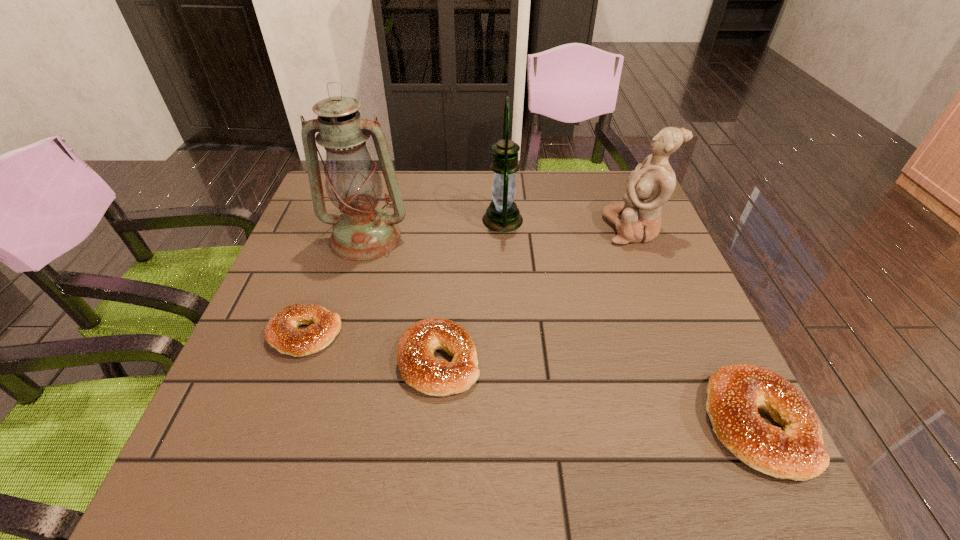
Where is `free space in the image that satisfies the following two spatial constraints: 1. on the front-facing side of the figurine; 2. on the front side of the second shortest bagel`? This screenshot has width=960, height=540. free space in the image that satisfies the following two spatial constraints: 1. on the front-facing side of the figurine; 2. on the front side of the second shortest bagel is located at coordinates (686, 361).

Where is `blank area in the image that satisfies the following two spatial constraints: 1. on the side where the fifth shortest object emits light; 2. on the front side of the shortest object`? blank area in the image that satisfies the following two spatial constraints: 1. on the side where the fifth shortest object emits light; 2. on the front side of the shortest object is located at coordinates (510, 334).